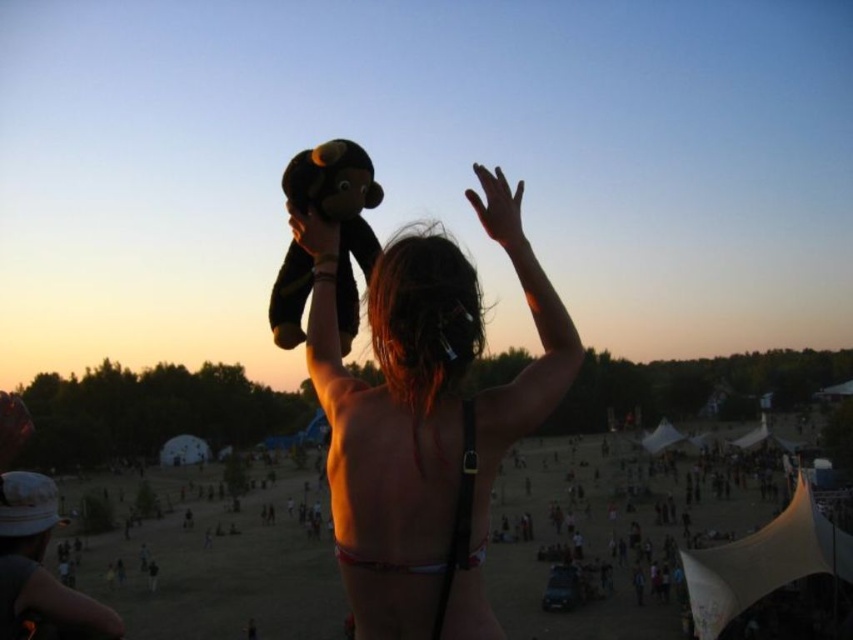
Which is in front, point (440, 392) or point (378, 566)?

Point (378, 566) is in front.

Is point (468, 428) positioned behind point (349, 554)?

Yes, it is.

Locate an element on the screen. matte black plush monkey at upper center is located at coordinates (427, 385).

Can you confirm if soft plush monkey at upper center is thinner than white matte bikini top at upper center?

Correct, soft plush monkey at upper center's width is less than white matte bikini top at upper center's.

Which is behind, point (335, 170) or point (440, 564)?

The point (335, 170) is behind.

Find the location of a particular element. The height and width of the screenshot is (640, 853). soft plush monkey at upper center is located at coordinates (338, 212).

Is matte black plush monkey at upper center positioned in front of soft plush monkey at upper center?

Yes.

Where is `matte black plush monkey at upper center`? The height and width of the screenshot is (640, 853). matte black plush monkey at upper center is located at coordinates (427, 385).

Is point (456, 353) closer to viewer compared to point (370, 186)?

Yes, it is in front of point (370, 186).

You are a GUI agent. You are given a task and a screenshot of the screen. Output one action in this format:
    pyautogui.click(x=<x>, y=<y>)
    Task: Click on the matte black plush monkey at upper center
    This screenshot has height=640, width=853.
    Given the screenshot: What is the action you would take?
    pyautogui.click(x=427, y=385)